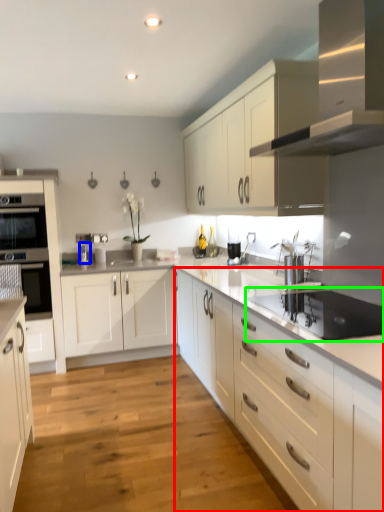
Question: Considering the real-world distances, which object is farthest from cabinetry (highlighted by a red box)? faucet (highlighted by a blue box) or appliance (highlighted by a green box)?

Choices:
 (A) faucet
 (B) appliance

Answer: (A)